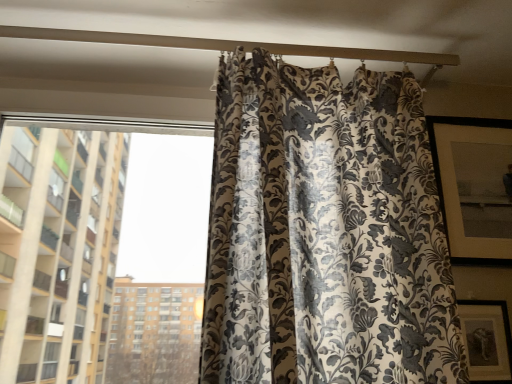
Question: Could you tell me if white matte beam at upper center is facing silky floral curtain at right?

Choices:
 (A) yes
 (B) no

Answer: (B)

Question: Is white matte beam at upper center taller than silky floral curtain at right?

Choices:
 (A) no
 (B) yes

Answer: (A)

Question: Is silky floral curtain at right a part of white matte beam at upper center?

Choices:
 (A) no
 (B) yes

Answer: (A)

Question: Can you confirm if white matte beam at upper center is thinner than silky floral curtain at right?

Choices:
 (A) no
 (B) yes

Answer: (A)

Question: Does white matte beam at upper center come in front of silky floral curtain at right?

Choices:
 (A) yes
 (B) no

Answer: (A)

Question: Can you confirm if white matte beam at upper center is shorter than silky floral curtain at right?

Choices:
 (A) no
 (B) yes

Answer: (B)

Question: Does silky floral curtain at right appear on the left side of white matte beam at upper center?

Choices:
 (A) no
 (B) yes

Answer: (A)

Question: From the image's perspective, would you say silky floral curtain at right is positioned over white matte beam at upper center?

Choices:
 (A) no
 (B) yes

Answer: (A)

Question: From a real-world perspective, is silky floral curtain at right beneath white matte beam at upper center?

Choices:
 (A) no
 (B) yes

Answer: (B)

Question: Does silky floral curtain at right have a greater height compared to white matte beam at upper center?

Choices:
 (A) no
 (B) yes

Answer: (B)

Question: Is there a large distance between silky floral curtain at right and white matte beam at upper center?

Choices:
 (A) yes
 (B) no

Answer: (B)

Question: Is silky floral curtain at right further to camera compared to white matte beam at upper center?

Choices:
 (A) yes
 (B) no

Answer: (A)

Question: Is silky floral-patterned curtain at center smaller than white matte beam at upper center?

Choices:
 (A) yes
 (B) no

Answer: (B)